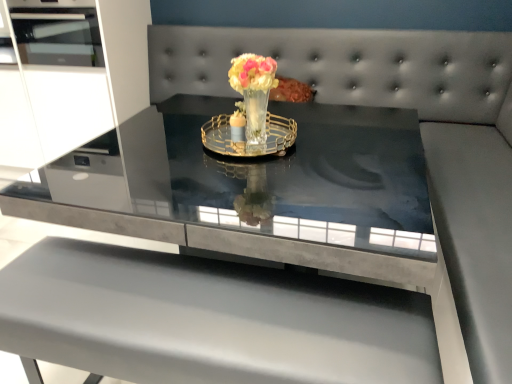
Where is `smooth gray couch at center`? Image resolution: width=512 pixels, height=384 pixels. smooth gray couch at center is located at coordinates (423, 145).

This screenshot has height=384, width=512. In order to click on gold metallic tray at center in this screenshot , I will do `click(246, 141)`.

Locate an element on the screen. matte gray table at center is located at coordinates (208, 319).

The width and height of the screenshot is (512, 384). Describe the element at coordinates (250, 113) in the screenshot. I see `translucent glass vase at center` at that location.

Looking at this image, measure the distance between point (233, 149) and camera.

5.23 feet.

At what (x,y) coordinates should I click in order to perform the action: click on smooth gray couch at center. Please return your answer as a coordinate pair (x, y). The height and width of the screenshot is (384, 512). Looking at the image, I should click on (423, 145).

In terms of size, does translucent glass vase at center appear bigger or smaller than smooth gray couch at center?

Considering their sizes, translucent glass vase at center takes up less space than smooth gray couch at center.

Can we say translucent glass vase at center lies outside smooth gray couch at center?

Yes, translucent glass vase at center is not within smooth gray couch at center.

From the image's perspective, which is above, translucent glass vase at center or smooth gray couch at center?

translucent glass vase at center.

Does translucent glass vase at center turn towards smooth gray couch at center?

No, translucent glass vase at center is not turned towards smooth gray couch at center.

Can you confirm if matte gray table at center is positioned to the right of gold metallic tray at center?

No, matte gray table at center is not to the right of gold metallic tray at center.

Does matte gray table at center have a greater height compared to gold metallic tray at center?

Yes, matte gray table at center is taller than gold metallic tray at center.

Does point (311, 301) come in front of point (221, 149)?

Yes.

From a real-world perspective, is matte gray table at center above or below gold metallic tray at center?

From a real-world perspective, matte gray table at center is physically below gold metallic tray at center.

Is gold metallic tray at center aimed at translucent glass vase at center?

Yes, gold metallic tray at center is oriented towards translucent glass vase at center.

Can translucent glass vase at center be found inside gold metallic tray at center?

That's incorrect, translucent glass vase at center is not inside gold metallic tray at center.

In the image, is gold metallic tray at center positioned in front of or behind translucent glass vase at center?

gold metallic tray at center is positioned farther from the viewer than translucent glass vase at center.

Considering the sizes of objects gold metallic tray at center and smooth gray couch at center in the image provided, who is thinner, gold metallic tray at center or smooth gray couch at center?

With smaller width is gold metallic tray at center.

Find the location of `couch in front of the gold metallic tray at center`. couch in front of the gold metallic tray at center is located at coordinates (423, 145).

Considering the points (213, 145) and (479, 141), which point is in front, point (213, 145) or point (479, 141)?

The point (213, 145) is more forward.

Is gold metallic tray at center oriented away from smooth gray couch at center?

No, gold metallic tray at center's orientation is not away from smooth gray couch at center.

This screenshot has height=384, width=512. Find the location of `couch below the translucent glass vase at center (from the image's perspective)`. couch below the translucent glass vase at center (from the image's perspective) is located at coordinates (423, 145).

Choose the correct answer: Is smooth gray couch at center inside translucent glass vase at center or outside it?

The correct answer is: outside.

What's the angular difference between smooth gray couch at center and translucent glass vase at center's facing directions?

There is a 7.48-degree angle between the facing directions of smooth gray couch at center and translucent glass vase at center.

Does smooth gray couch at center have a greater height compared to translucent glass vase at center?

Indeed, smooth gray couch at center has a greater height compared to translucent glass vase at center.

Is smooth gray couch at center positioned far away from gold metallic tray at center?

Absolutely, smooth gray couch at center is distant from gold metallic tray at center.

Is point (457, 203) positioned in front of point (220, 137)?

That is False.

Who is taller, smooth gray couch at center or gold metallic tray at center?

With more height is smooth gray couch at center.

In the scene shown: Is matte gray table at center at the back of smooth gray couch at center?

smooth gray couch at center is not turned away from matte gray table at center.

Considering the positions of objects smooth gray couch at center and matte gray table at center in the image provided, who is more to the right, smooth gray couch at center or matte gray table at center?

smooth gray couch at center is more to the right.

How different are the orientations of smooth gray couch at center and matte gray table at center in degrees?

The angle between the facing direction of smooth gray couch at center and the facing direction of matte gray table at center is 180 degrees.

The height and width of the screenshot is (384, 512). I want to click on couch on the right of translucent glass vase at center, so click(423, 145).

Image resolution: width=512 pixels, height=384 pixels. I want to click on glass plate above the matte gray table at center (from the image's perspective), so click(246, 141).

Which object lies further to the anchor point translucent glass vase at center, matte gray table at center or smooth gray couch at center?

smooth gray couch at center is positioned further to the anchor translucent glass vase at center.

Estimate the real-world distances between objects in this image. Which object is closer to gold metallic tray at center, translucent glass vase at center or smooth gray couch at center?

Based on the image, translucent glass vase at center appears to be nearer to gold metallic tray at center.

Based on their spatial positions, is matte gray table at center or translucent glass vase at center further from gold metallic tray at center?

matte gray table at center is further to gold metallic tray at center.

Which object lies nearer to the anchor point smooth gray couch at center, gold metallic tray at center or matte gray table at center?

Based on the image, gold metallic tray at center appears to be nearer to smooth gray couch at center.

Based on their spatial positions, is matte gray table at center or gold metallic tray at center further from translucent glass vase at center?

matte gray table at center.

In the scene shown: Estimate the real-world distances between objects in this image. Which object is further from translucent glass vase at center, gold metallic tray at center or matte gray table at center?

matte gray table at center is positioned further to the anchor translucent glass vase at center.

Which object lies nearer to the anchor point matte gray table at center, gold metallic tray at center or translucent glass vase at center?

gold metallic tray at center.

Which object lies nearer to the anchor point matte gray table at center, translucent glass vase at center or smooth gray couch at center?

Based on the image, translucent glass vase at center appears to be nearer to matte gray table at center.

You are a GUI agent. You are given a task and a screenshot of the screen. Output one action in this format:
    pyautogui.click(x=<x>, y=<y>)
    Task: Click on the couch between gold metallic tray at center and matte gray table at center vertically
    
    Given the screenshot: What is the action you would take?
    pyautogui.click(x=423, y=145)

I want to click on couch between translucent glass vase at center and matte gray table at center vertically, so click(x=423, y=145).

Identify the location of floral arrangement between smooth gray couch at center and gold metallic tray at center from front to back. Image resolution: width=512 pixels, height=384 pixels. (250, 113).

The image size is (512, 384). In order to click on glass plate between translucent glass vase at center and matte gray table at center from top to bottom in this screenshot , I will do `click(246, 141)`.